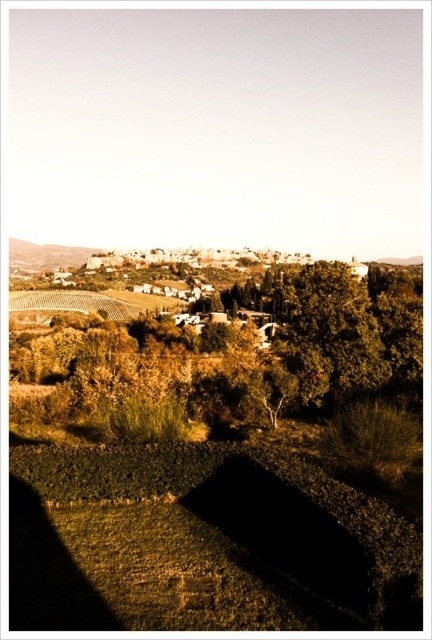
You are a photographer planning to capture the green leafy tree at center and the earthy brown stone wall at upper left in a single shot. Based on their positions, will the tree appear in front of the wall in your photo?

Yes, the green leafy tree at center is in front of the earthy brown stone wall at upper left, so it will appear in front of the wall in the photo.

You are a hiker standing at the base of the earthy brown stone wall at upper left, looking down towards the green leafy tree at center. Which direction should you walk to reach the tree?

The green leafy tree at center is below the earthy brown stone wall at upper left, so you should walk downward to reach it.

You are planning to plant a new tree in this landscape. The green leafy tree at center and the earthy brown stone wall at upper left are already present. Considering their sizes, which object would require more space around it to avoid overcrowding?

The green leafy tree at center requires more space around it because its width is larger than that of the earthy brown stone wall at upper left.